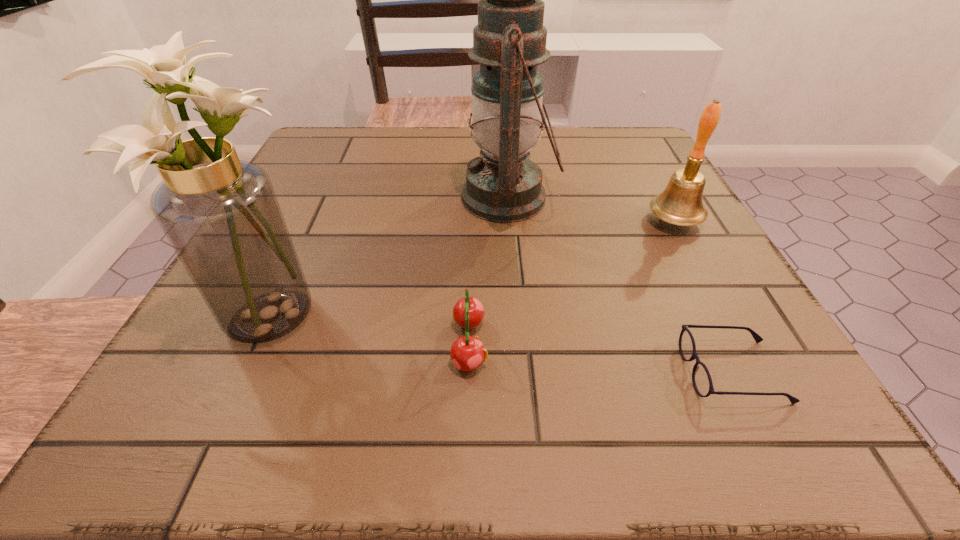
Find the location of a particular element. Image resolution: width=960 pixels, height=540 pixels. free spot located on the front-facing side of the spectacles is located at coordinates (496, 372).

This screenshot has width=960, height=540. In order to click on vacant space located on the front-facing side of the spectacles in this screenshot , I will do `click(482, 372)`.

Where is `object at the far edge`? object at the far edge is located at coordinates (502, 185).

I want to click on object located at the near edge, so click(x=701, y=378).

Locate an element on the screen. This screenshot has width=960, height=540. object at the left edge is located at coordinates (221, 215).

At what (x,y) coordinates should I click in order to perform the action: click on bell present at the right edge. Please return your answer as a coordinate pair (x, y). The width and height of the screenshot is (960, 540). Looking at the image, I should click on (680, 203).

Identify the location of spectacles present at the right edge. (701, 378).

Where is `object present at the near right corner`? This screenshot has width=960, height=540. object present at the near right corner is located at coordinates (701, 378).

Locate an element on the screen. The image size is (960, 540). vacant point at the far edge is located at coordinates (458, 131).

This screenshot has height=540, width=960. I want to click on vacant space at the near edge of the desktop, so click(x=656, y=414).